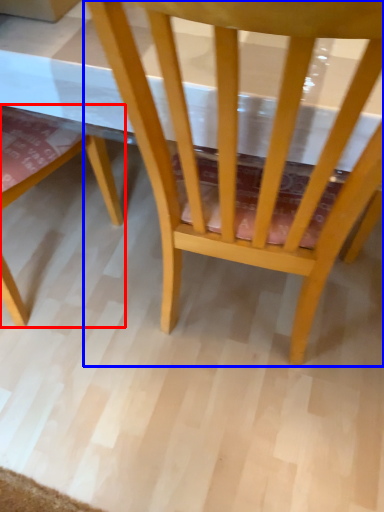
Question: Which of the following is the farthest to the observer, chair (highlighted by a red box) or chair (highlighted by a blue box)?

Choices:
 (A) chair
 (B) chair

Answer: (A)